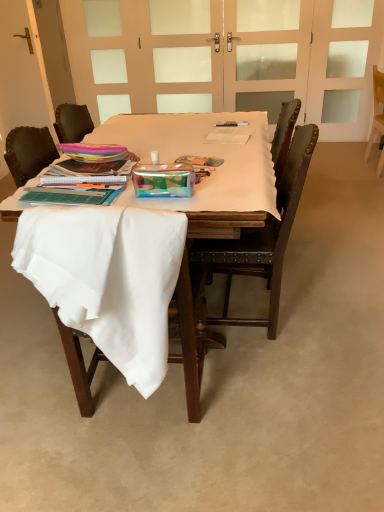
Question: Can you confirm if white fabric chair at lower left, which is counted as the first chair, starting from the front, is wider than transparent glass screen door at upper center, the second screen door in the left-to-right sequence?

Choices:
 (A) no
 (B) yes

Answer: (B)

Question: Is white fabric chair at lower left, marked as the first chair in a left-to-right arrangement, outside of transparent glass screen door at upper center, the second screen door in the left-to-right sequence?

Choices:
 (A) no
 (B) yes

Answer: (B)

Question: Is white fabric chair at lower left, which is the third chair from right to left, positioned with its back to transparent glass screen door at upper center, which ranks as the second screen door in right-to-left order?

Choices:
 (A) no
 (B) yes

Answer: (A)

Question: Is white fabric chair at lower left, marked as the first chair in a left-to-right arrangement, facing towards transparent glass screen door at upper center, the second screen door in the left-to-right sequence?

Choices:
 (A) no
 (B) yes

Answer: (B)

Question: From a real-world perspective, does white fabric chair at lower left, which ranks as the 3th chair in back-to-front order, sit lower than transparent glass screen door at upper center, which ranks as the second screen door in right-to-left order?

Choices:
 (A) yes
 (B) no

Answer: (A)

Question: Is metallic silver pen at center inside the boundaries of white matte door at upper center, or outside?

Choices:
 (A) inside
 (B) outside

Answer: (B)

Question: Looking at their shapes, would you say metallic silver pen at center is wider or thinner than white matte door at upper center?

Choices:
 (A) wide
 (B) thin

Answer: (A)

Question: Is metallic silver pen at center bigger or smaller than white matte door at upper center?

Choices:
 (A) small
 (B) big

Answer: (A)

Question: Considering their positions, is metallic silver pen at center located in front of or behind white matte door at upper center?

Choices:
 (A) front
 (B) behind

Answer: (A)

Question: Considering the positions of white matte door at upper center and white fabric-covered table at center in the image, is white matte door at upper center wider or thinner than white fabric-covered table at center?

Choices:
 (A) wide
 (B) thin

Answer: (B)

Question: From the image's perspective, is white matte door at upper center located above or below white fabric-covered table at center?

Choices:
 (A) below
 (B) above

Answer: (B)

Question: From a real-world perspective, is white matte door at upper center physically located above or below white fabric-covered table at center?

Choices:
 (A) above
 (B) below

Answer: (A)

Question: Looking at the image, does white matte door at upper center seem bigger or smaller compared to white fabric-covered table at center?

Choices:
 (A) big
 (B) small

Answer: (B)

Question: Is white matte door at upper center wider or thinner than white frosted glass screen door at upper right, the 3th screen door in the left-to-right sequence?

Choices:
 (A) wide
 (B) thin

Answer: (B)

Question: Is point (127, 105) positioned closer to the camera than point (379, 45)?

Choices:
 (A) farther
 (B) closer

Answer: (A)